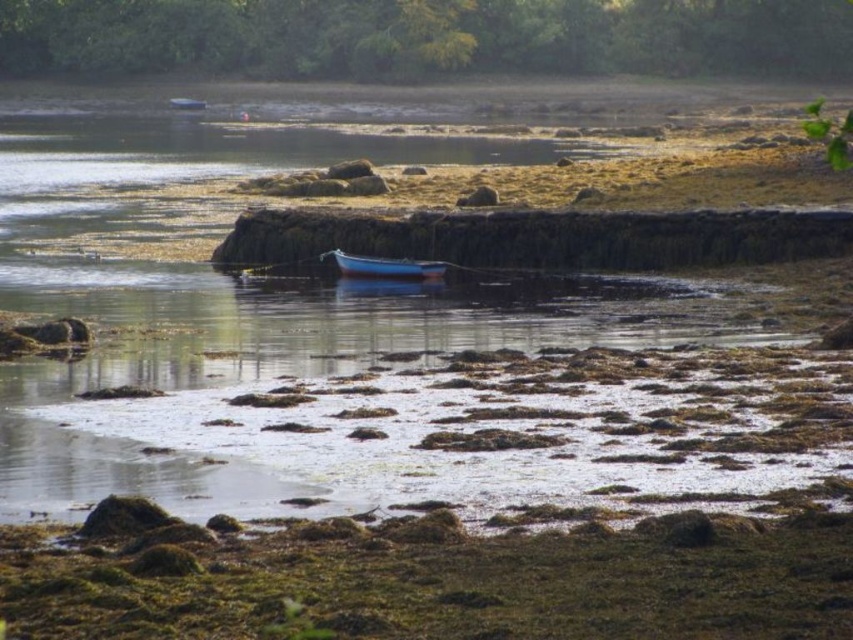
Question: Among these objects, which one is nearest to the camera?

Choices:
 (A) blue polished wood boat at center
 (B) blue glossy boat at upper center

Answer: (A)

Question: Is blue polished wood boat at center to the right of blue glossy boat at upper center from the viewer's perspective?

Choices:
 (A) no
 (B) yes

Answer: (B)

Question: From the image, what is the correct spatial relationship of blue polished wood boat at center in relation to blue glossy boat at upper center?

Choices:
 (A) left
 (B) right

Answer: (B)

Question: Can you confirm if blue polished wood boat at center is bigger than blue glossy boat at upper center?

Choices:
 (A) no
 (B) yes

Answer: (B)

Question: Which object is farther from the camera taking this photo?

Choices:
 (A) blue glossy boat at upper center
 (B) blue polished wood boat at center

Answer: (A)